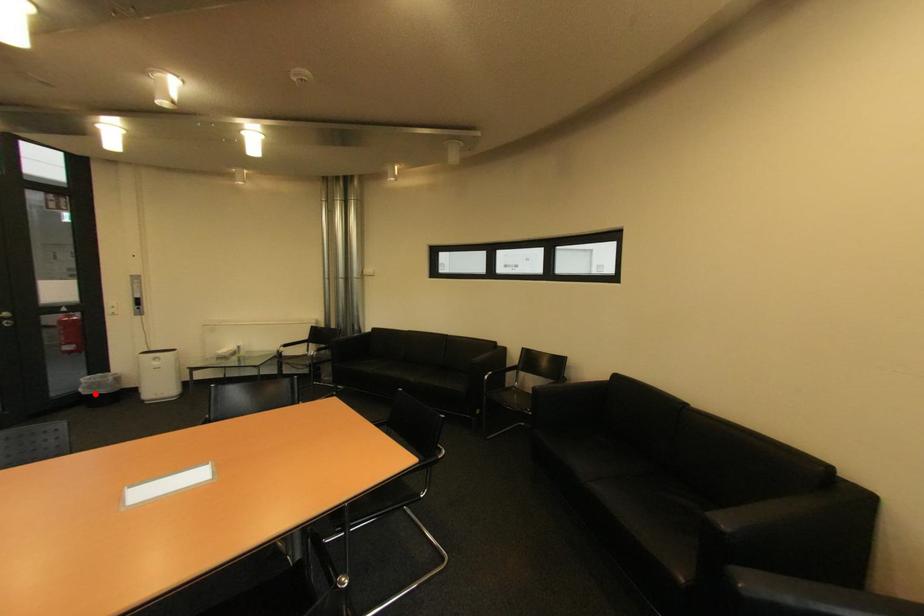
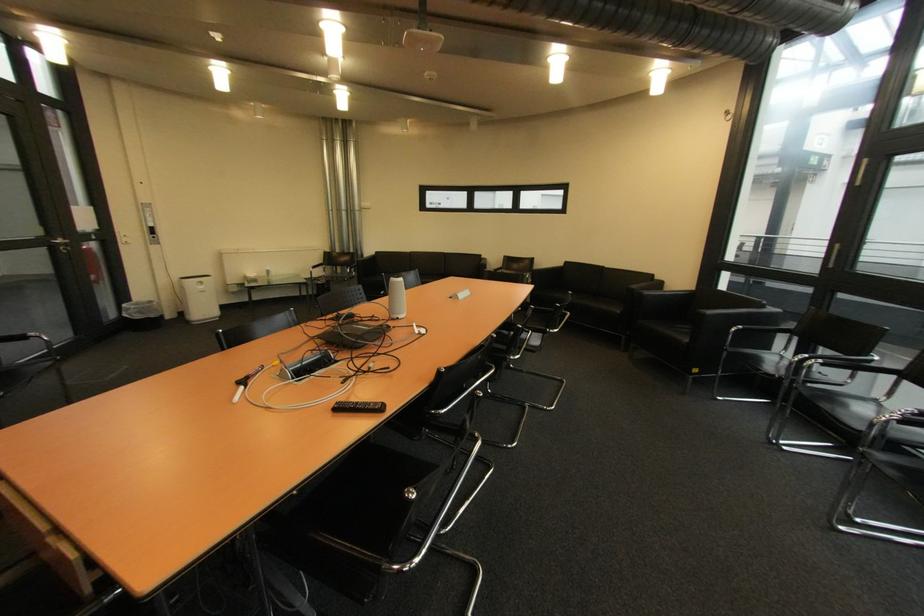
Locate, in the second image, the point that corresponds to the highlighted location in the first image.

(147, 318)